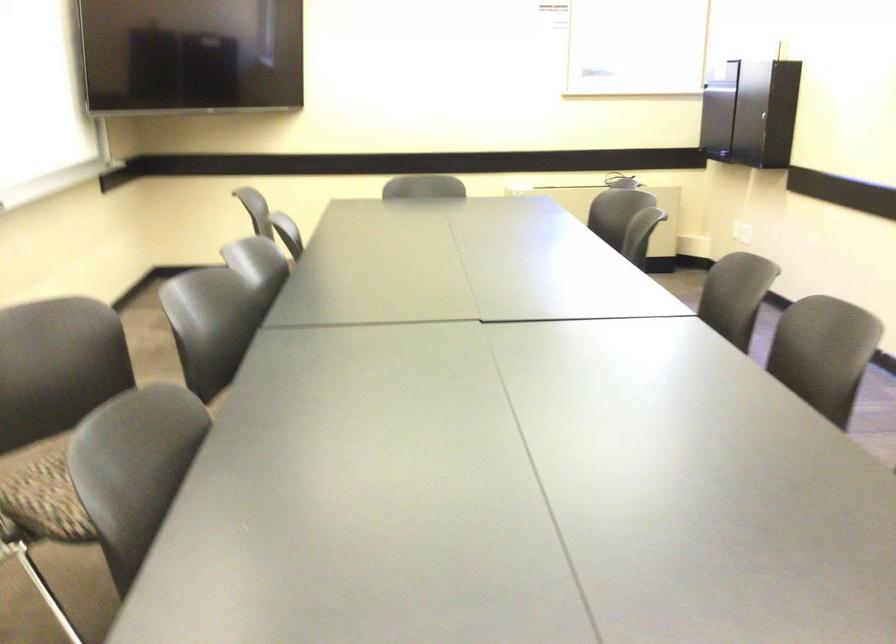
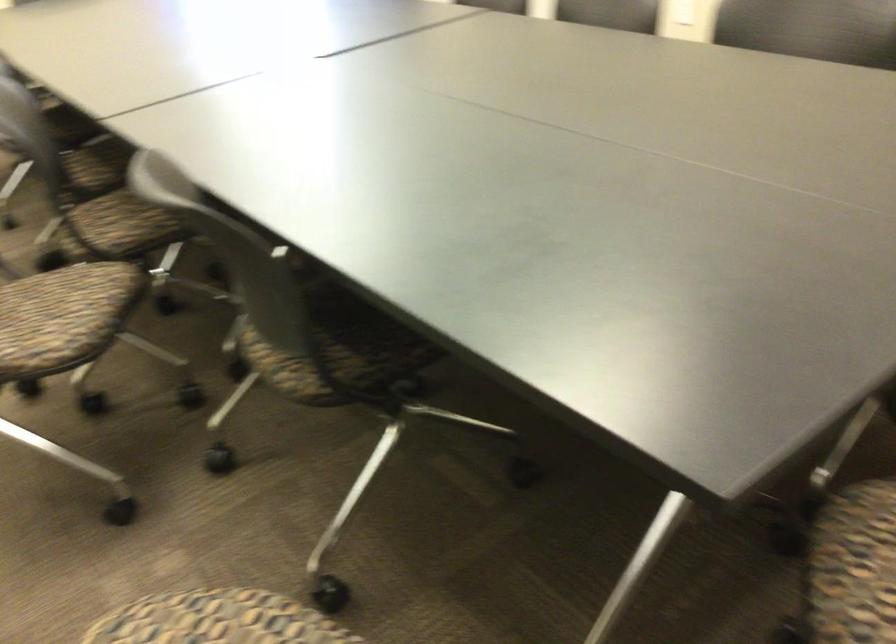
The images are taken continuously from a first-person perspective. In which direction is your viewpoint rotating?

The rotation direction of the camera is right-down.